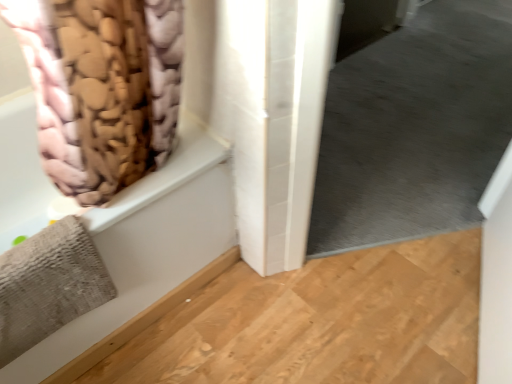
Question: Is gray matte carpet at lower right shorter than beige fabric bath at left?

Choices:
 (A) yes
 (B) no

Answer: (B)

Question: Is gray matte carpet at lower right bigger than beige fabric bath at left?

Choices:
 (A) no
 (B) yes

Answer: (A)

Question: Can you see gray matte carpet at lower right touching beige fabric bath at left?

Choices:
 (A) no
 (B) yes

Answer: (A)

Question: From a real-world perspective, is gray matte carpet at lower right physically below beige fabric bath at left?

Choices:
 (A) yes
 (B) no

Answer: (B)

Question: Are gray matte carpet at lower right and beige fabric bath at left far apart?

Choices:
 (A) no
 (B) yes

Answer: (B)

Question: Is the depth of gray matte carpet at lower right less than that of beige fabric bath at left?

Choices:
 (A) no
 (B) yes

Answer: (A)

Question: Is gray matte carpet at lower right shorter than pink fabric curtain at upper left?

Choices:
 (A) no
 (B) yes

Answer: (A)

Question: Can you confirm if gray matte carpet at lower right is wider than pink fabric curtain at upper left?

Choices:
 (A) no
 (B) yes

Answer: (A)

Question: Is gray matte carpet at lower right outside pink fabric curtain at upper left?

Choices:
 (A) no
 (B) yes

Answer: (B)

Question: Does gray matte carpet at lower right have a larger size compared to pink fabric curtain at upper left?

Choices:
 (A) no
 (B) yes

Answer: (B)

Question: Does gray matte carpet at lower right have a smaller size compared to pink fabric curtain at upper left?

Choices:
 (A) yes
 (B) no

Answer: (B)

Question: Is gray matte carpet at lower right at the right side of pink fabric curtain at upper left?

Choices:
 (A) no
 (B) yes

Answer: (B)

Question: Is beige fabric bath at left positioned beyond the bounds of gray matte carpet at lower right?

Choices:
 (A) no
 (B) yes

Answer: (B)